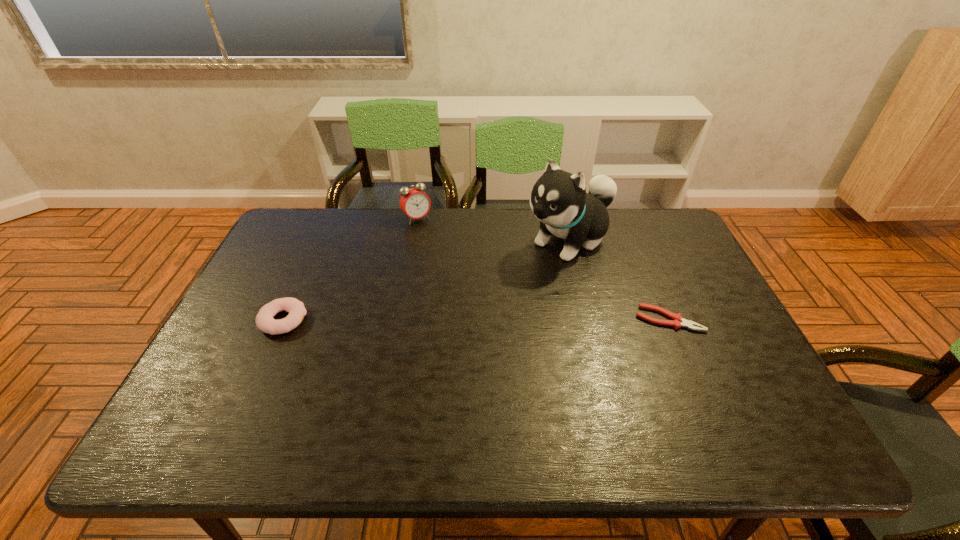
Locate an element on the screen. vacant space on the desktop that is between the leftmost object and the pliers and is positioned at the face of the puppy is located at coordinates (454, 320).

This screenshot has width=960, height=540. I want to click on vacant space on the desktop that is between the third tallest object and the shortest object and is positioned on the front-facing side of the second tallest object, so click(x=495, y=320).